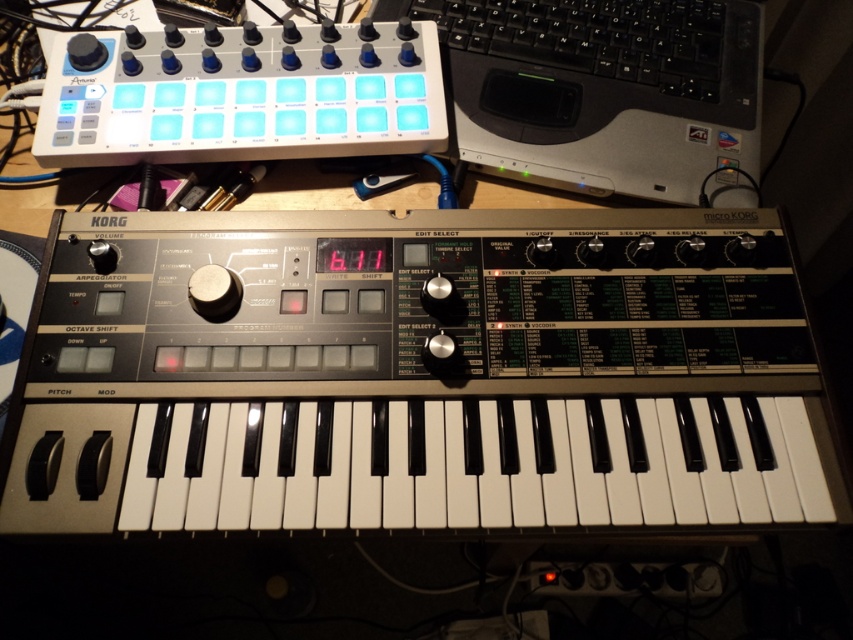
Question: Is the position of metallic silver piano at center less distant than that of blue plastic pads at upper left?

Choices:
 (A) no
 (B) yes

Answer: (B)

Question: Which of these objects is positioned farthest from the black plastic keyboard at upper right?

Choices:
 (A) blue plastic pads at upper left
 (B) silver/black plastic laptop at upper right
 (C) metallic silver piano at center

Answer: (C)

Question: Does silver/black plastic laptop at upper right appear on the right side of blue plastic pads at upper left?

Choices:
 (A) yes
 (B) no

Answer: (A)

Question: Which object is positioned closest to the silver/black plastic laptop at upper right?

Choices:
 (A) black plastic keyboard at upper right
 (B) blue plastic pads at upper left

Answer: (A)

Question: Which point is closer to the camera?

Choices:
 (A) black plastic keyboard at upper right
 (B) silver/black plastic laptop at upper right
 (C) metallic silver piano at center

Answer: (C)

Question: Does silver/black plastic laptop at upper right appear under black plastic keyboard at upper right?

Choices:
 (A) no
 (B) yes

Answer: (B)